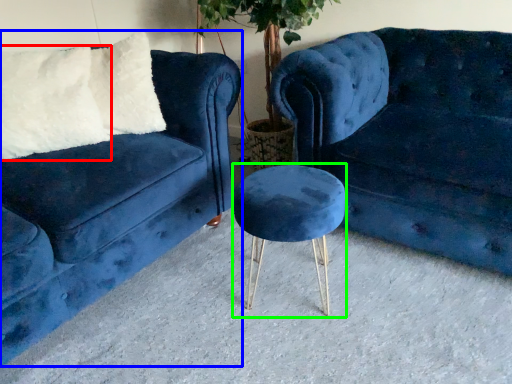
Question: Considering the real-world distances, which object is closest to pillow (highlighted by a red box)? studio couch (highlighted by a blue box) or bar stool (highlighted by a green box).

Choices:
 (A) studio couch
 (B) bar stool

Answer: (A)